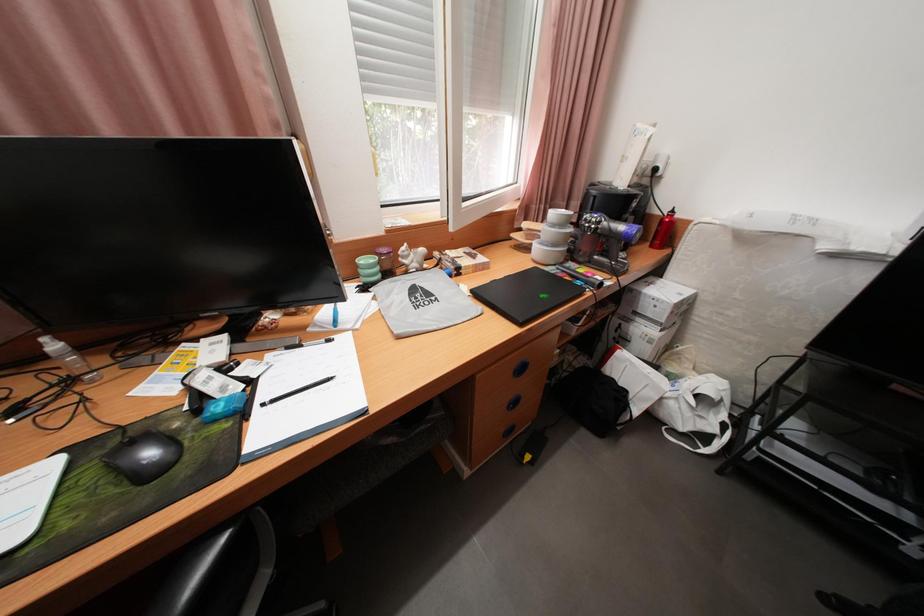
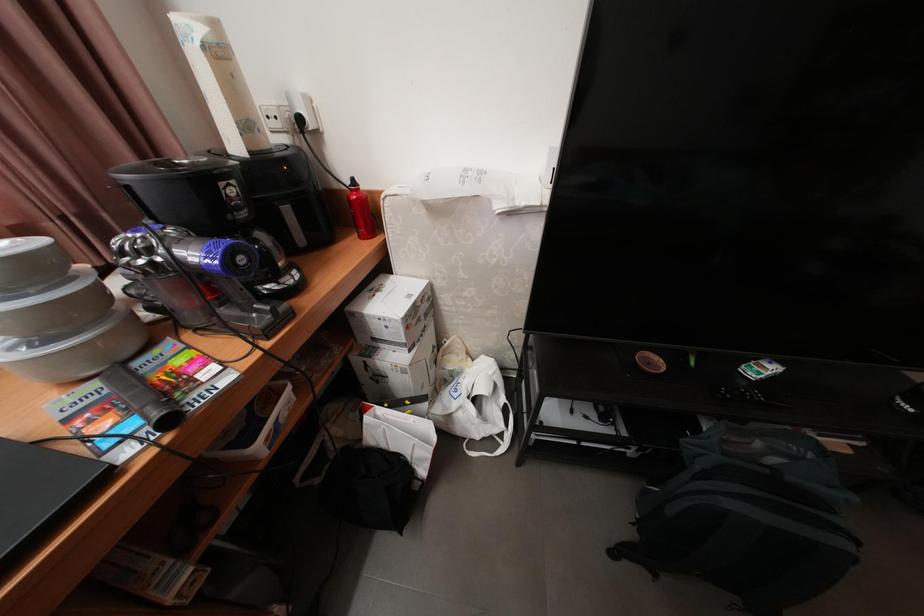
Question: Based on the continuous images, in which direction is the camera rotating? Reply with the corresponding letter.

Choices:
 (A) Left
 (B) Right
 (C) Up
 (D) Down

Answer: (B)